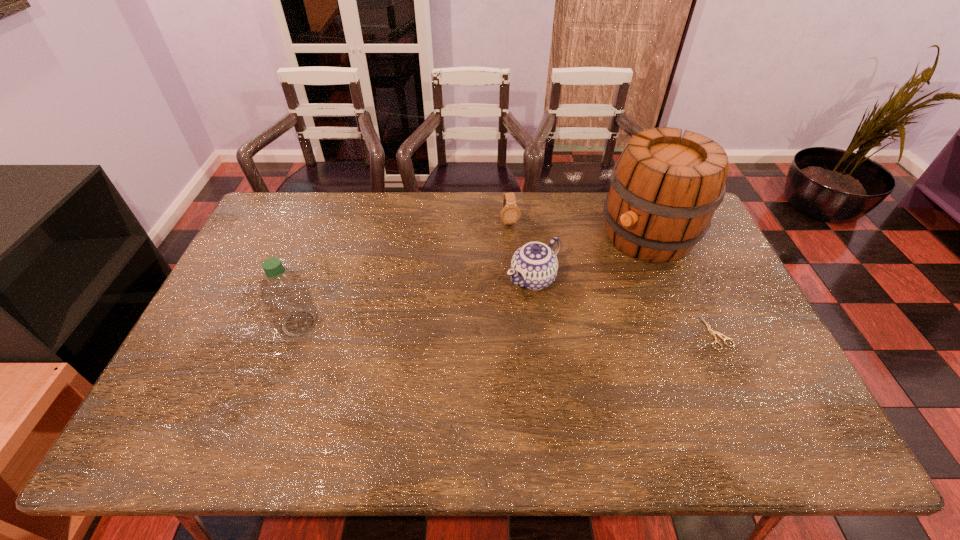
In order to click on the leftmost object in this screenshot , I will do `click(285, 295)`.

Image resolution: width=960 pixels, height=540 pixels. In order to click on water bottle in this screenshot , I will do `click(285, 295)`.

This screenshot has height=540, width=960. I want to click on shears, so click(709, 329).

This screenshot has width=960, height=540. I want to click on chinaware, so [x=534, y=266].

I want to click on the fourth tallest object, so click(x=510, y=213).

Image resolution: width=960 pixels, height=540 pixels. I want to click on cider, so click(x=664, y=190).

The width and height of the screenshot is (960, 540). I want to click on vacant area located 0.070m on the right of the water bottle, so click(345, 323).

You are a GUI agent. You are given a task and a screenshot of the screen. Output one action in this format:
    pyautogui.click(x=<x>, y=<y>)
    Task: Click on the blank space located 0.270m on the left of the shears
    
    Given the screenshot: What is the action you would take?
    pyautogui.click(x=608, y=333)

At what (x,y) coordinates should I click in order to perform the action: click on vacant area located 0.130m at the spout of the third shortest object. Please return your answer as a coordinate pair (x, y). This screenshot has height=540, width=960. Looking at the image, I should click on (482, 316).

You are a GUI agent. You are given a task and a screenshot of the screen. Output one action in this format:
    pyautogui.click(x=<x>, y=<y>)
    Task: Click on the vacant space situated 0.400m at the spout of the third shortest object
    This screenshot has height=540, width=960.
    Given the screenshot: What is the action you would take?
    pyautogui.click(x=405, y=374)